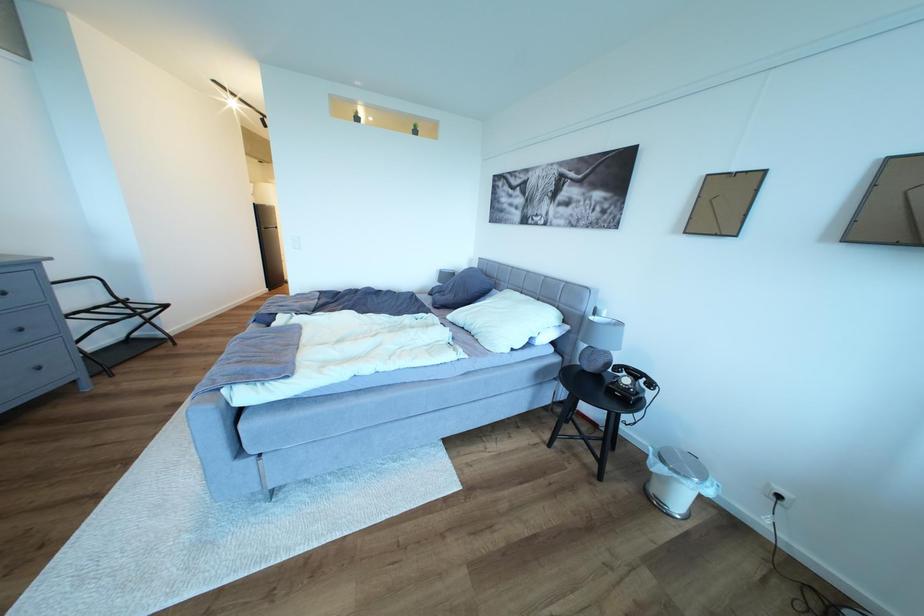
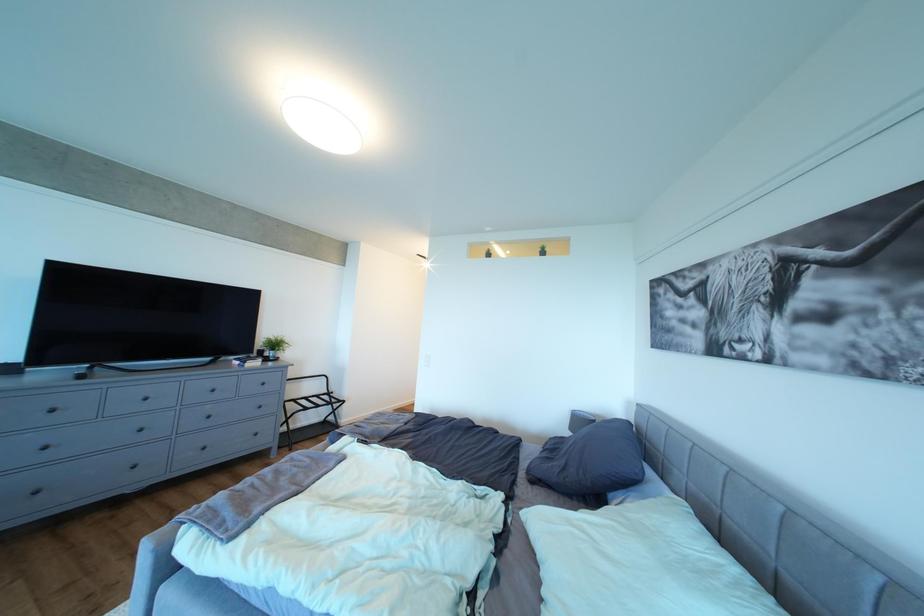
Consider the image. Based on the continuous images, in which direction is the camera rotating?

The camera's rotation is toward left-up.